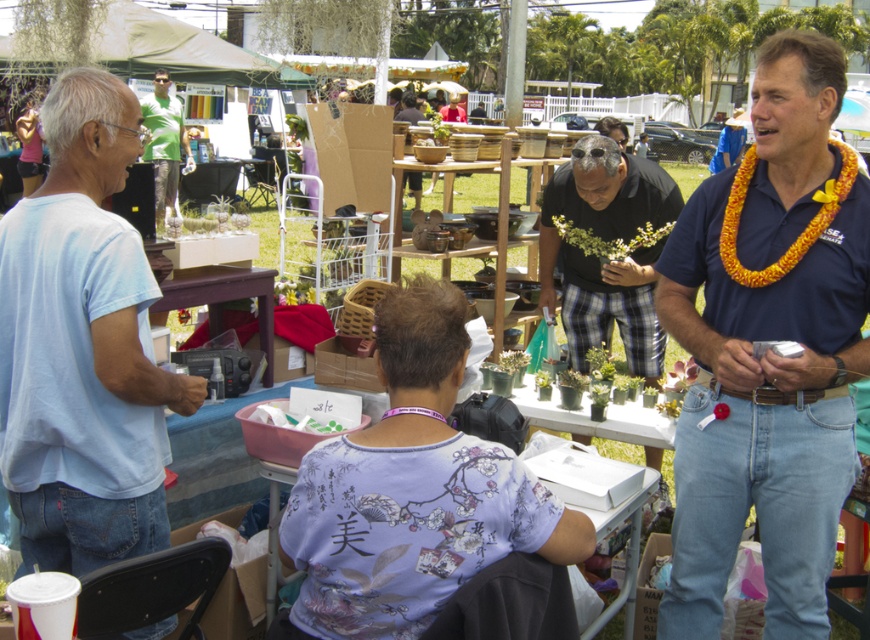
Is matte black shirt at center to the left of brown wood table at lower left from the viewer's perspective?

No, matte black shirt at center is not to the left of brown wood table at lower left.

Can you confirm if matte black shirt at center is shorter than brown wood table at lower left?

No.

Does point (648, 348) come in front of point (232, 294)?

No, (648, 348) is behind (232, 294).

At what (x,y) coordinates should I click in order to perform the action: click on matte black shirt at center. Please return your answer as a coordinate pair (x, y). The width and height of the screenshot is (870, 640). Looking at the image, I should click on (609, 260).

Can you confirm if blue shirt at center is positioned to the right of green fabric shirt at upper left?

Correct, you'll find blue shirt at center to the right of green fabric shirt at upper left.

Is blue shirt at center wider than green fabric shirt at upper left?

Incorrect, blue shirt at center's width does not surpass green fabric shirt at upper left's.

The image size is (870, 640). What are the coordinates of `blue shirt at center` in the screenshot? It's located at (768, 349).

Does blue shirt at center have a greater height compared to brown wood table at lower left?

Indeed, blue shirt at center has a greater height compared to brown wood table at lower left.

Does point (694, 550) come closer to viewer compared to point (201, 278)?

Yes, point (694, 550) is in front of point (201, 278).

Which is in front, point (713, 554) or point (211, 308)?

Point (713, 554)

At what (x,y) coordinates should I click in order to perform the action: click on blue shirt at center. Please return your answer as a coordinate pair (x, y). This screenshot has width=870, height=640. Looking at the image, I should click on (x=768, y=349).